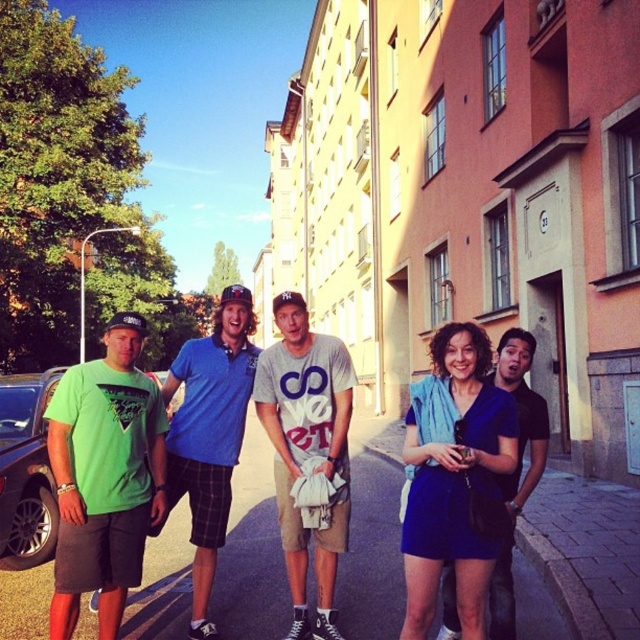
You are a photographer positioned at the origin point of the image. You need to capture a photo that includes the blue cotton polo shirt at center. According to the coordinates provided, where should you aim your camera to ensure the shirt is in the frame?

The blue cotton polo shirt at center is located at point (209, 435), so you should aim your camera towards those coordinates to include it in the frame.